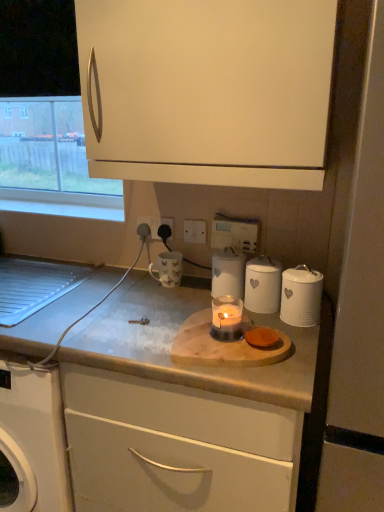
The image size is (384, 512). I want to click on free space above wooden cutting board at center (from a real-world perspective), so click(208, 338).